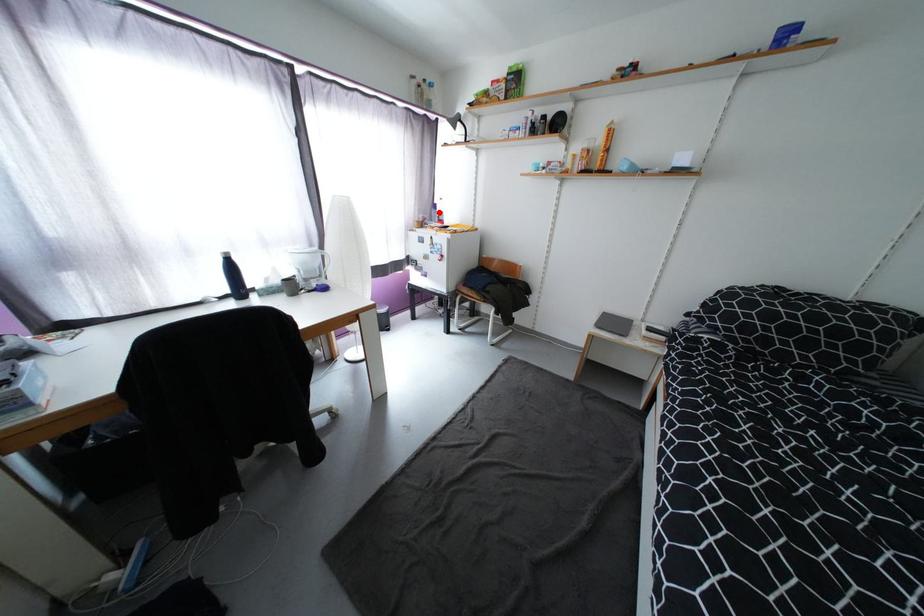
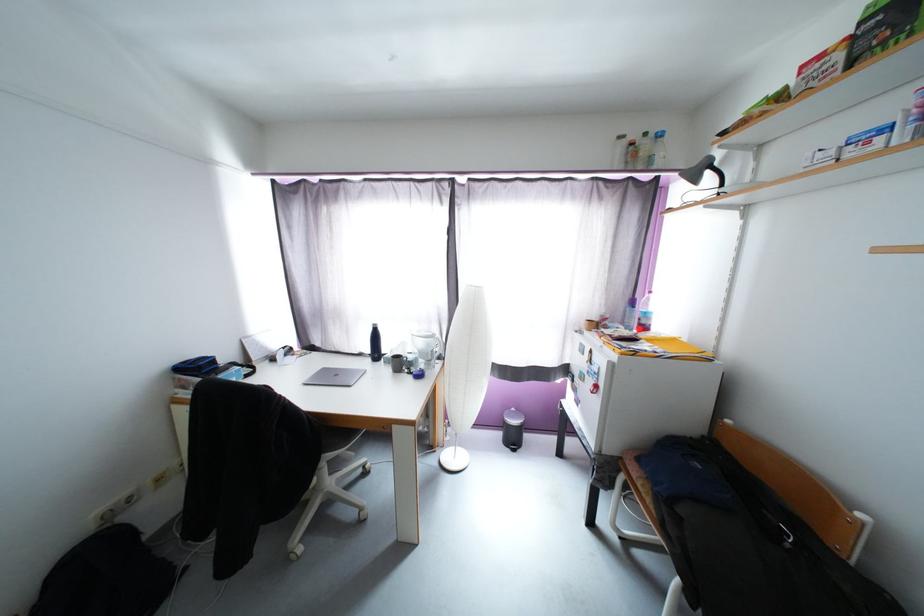
Question: A red point is marked in image1. In image2, is the corresponding 3D point closer to the camera or farther? Reply with the corresponding letter.

Choices:
 (A) The corresponding 3D point is closer.
 (B) The corresponding 3D point is farther.

Answer: (B)